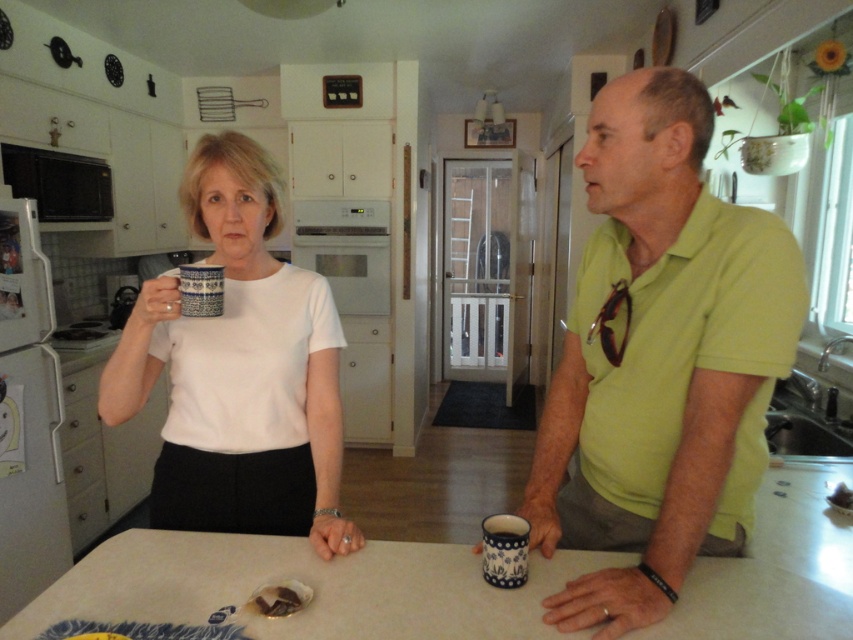
Looking at this image, you are organizing a kitchen inventory and need to place the blue ceramic mug at lower right and the blue ceramic mug at upper center into storage boxes. Which mug is located to the right of the other?

The blue ceramic mug at lower right is positioned on the right side of the blue ceramic mug at upper center.

Consider the image. You are a delivery robot with a package that requires placing on a surface between the green matte shirt at right and the white laminate table at center. The package is 30 centimeters wide. Can you fit it in the space between them?

The space between the green matte shirt at right and the white laminate table at center is 34.11 centimeters. Since the package is 30 centimeters wide, it can fit in the space between them.